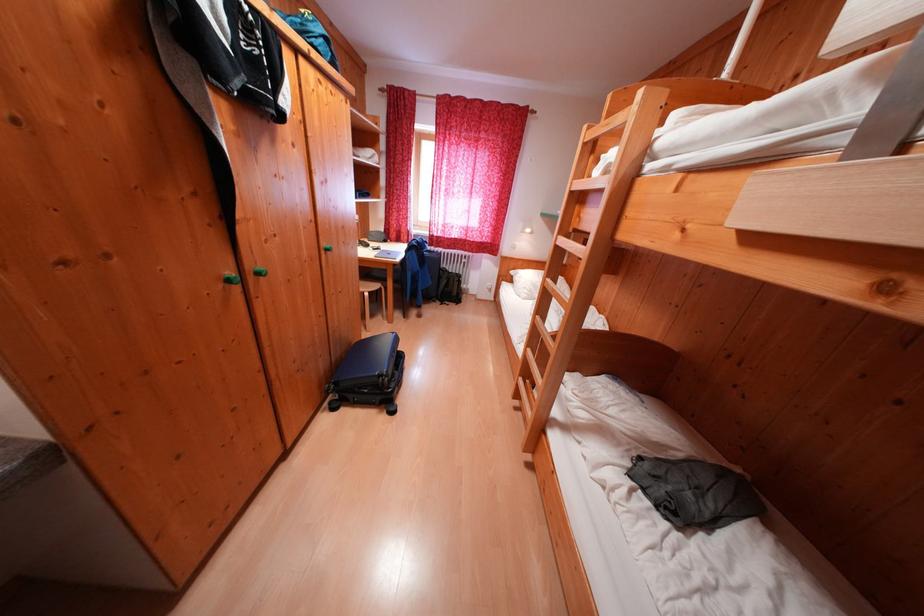
Find where to climb the wooden bunk bed ladder. Please return your answer as a coordinate pair (x, y).

(549, 349)